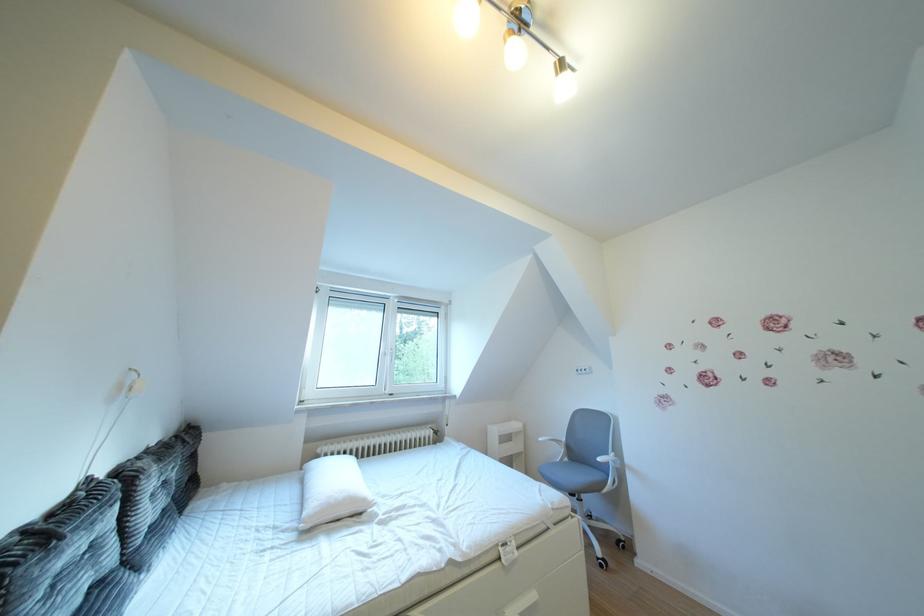
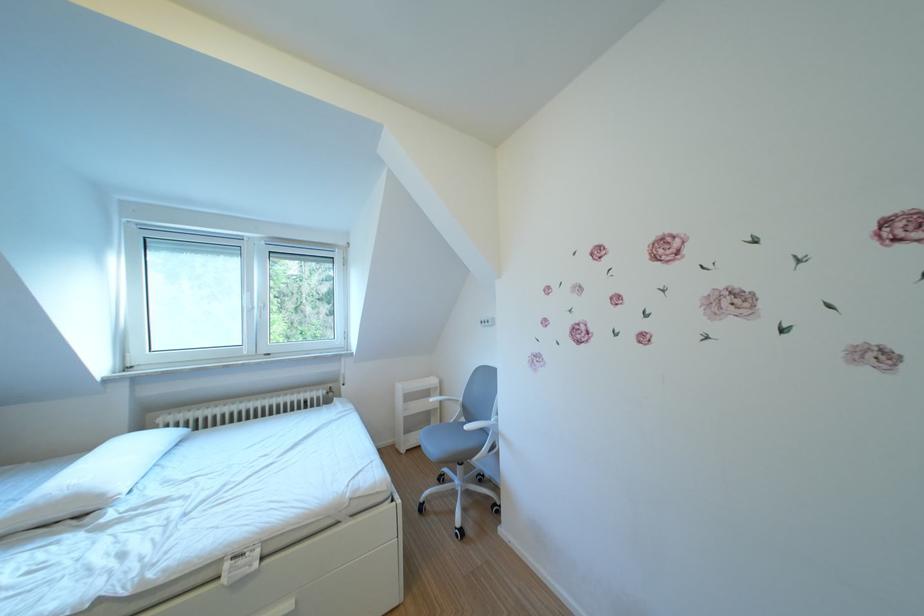
Locate, in the second image, the point that corresponds to pixel 378 505 in the first image.

(115, 501)